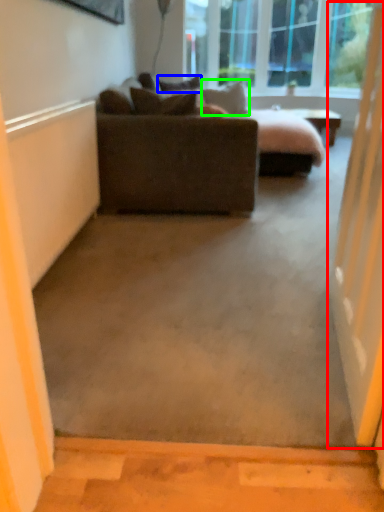
Question: Which object is the farthest from screen door (highlighted by a red box)? Choose among these: pillow (highlighted by a blue box) or pillow (highlighted by a green box).

Choices:
 (A) pillow
 (B) pillow

Answer: (B)